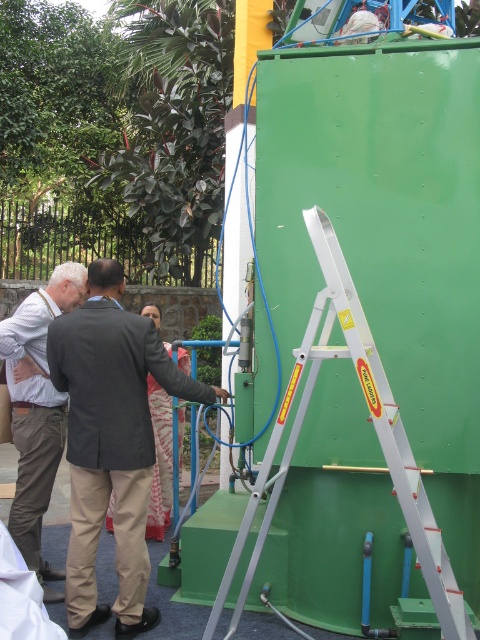
Question: Which of these objects is positioned closest to the silver/aluminum step ladder at right?

Choices:
 (A) light brown fabric shirt at left
 (B) dark gray suit at center

Answer: (B)

Question: Where is dark gray suit at center located in relation to silver/aluminum step ladder at right in the image?

Choices:
 (A) below
 (B) above

Answer: (A)

Question: Does silver/aluminum step ladder at right appear on the left side of light brown fabric shirt at left?

Choices:
 (A) yes
 (B) no

Answer: (B)

Question: Can you confirm if dark gray suit at center is wider than silver/aluminum step ladder at right?

Choices:
 (A) no
 (B) yes

Answer: (A)

Question: Estimate the real-world distances between objects in this image. Which object is closer to the dark gray suit at center?

Choices:
 (A) silver/aluminum step ladder at right
 (B) light brown fabric shirt at left

Answer: (B)

Question: Which point is farther from the camera taking this photo?

Choices:
 (A) (396, 470)
 (B) (48, 422)

Answer: (B)